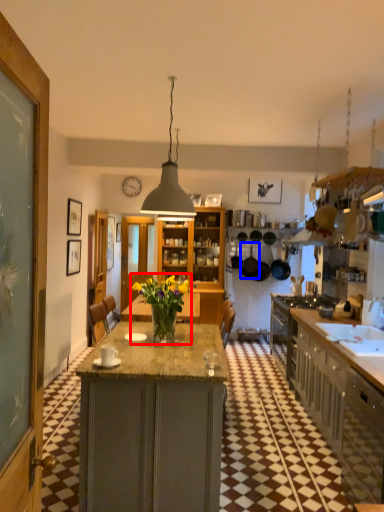
Question: Which object is further to the camera taking this photo, houseplant (highlighted by a red box) or kitchen appliance (highlighted by a blue box)?

Choices:
 (A) houseplant
 (B) kitchen appliance

Answer: (B)